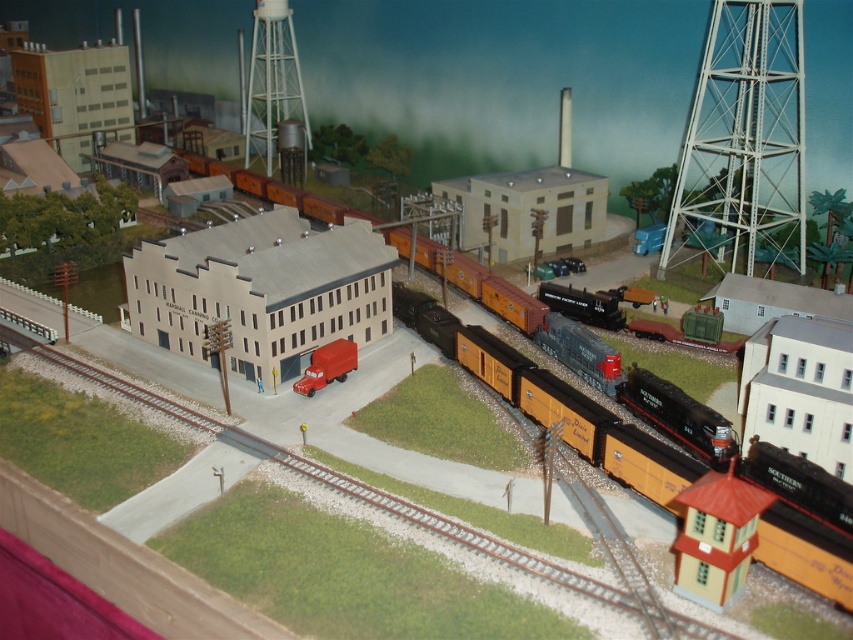
Question: Which point is closer to the camera taking this photo?

Choices:
 (A) (138, 304)
 (B) (305, 385)
 (C) (693, 156)

Answer: (B)

Question: Estimate the real-world distances between objects in this image. Which object is closer to the metallic freight car at center?

Choices:
 (A) matte red truck at center
 (B) white matte water tower at upper center
 (C) white metallic water tower at upper right

Answer: (B)

Question: Which of the following is the closest to the observer?

Choices:
 (A) white matte water tower at upper center
 (B) matte red truck at center
 (C) orange matte freight car at center

Answer: (C)

Question: Can you confirm if orange matte freight car at center is thinner than metallic freight car at center?

Choices:
 (A) yes
 (B) no

Answer: (A)

Question: Is metallic freight car at center wider than white matte water tower at upper center?

Choices:
 (A) yes
 (B) no

Answer: (A)

Question: In this image, where is white metallic water tower at upper right located relative to matte red truck at center?

Choices:
 (A) right
 (B) left

Answer: (A)